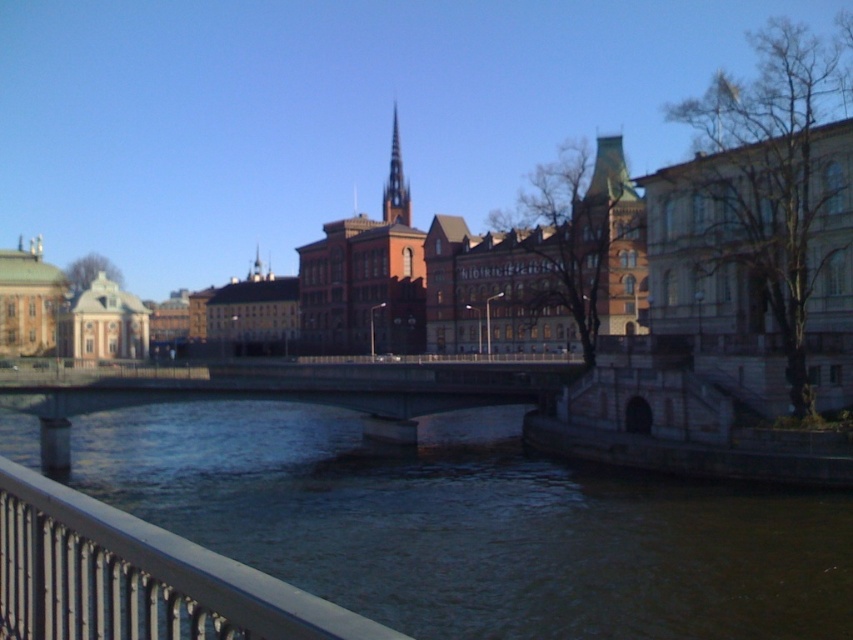
From the picture: You are a city planner evaluating the riverside area. You need to determine which of the two objects, the brown concrete river at center or the smooth stone spire at center, is more suitable for installing a new public art installation. Based on their sizes, which one would you recommend and why?

The smooth stone spire at center is larger than the brown concrete river at center, making it a better candidate for a public art installation as it can accommodate larger sculptures or structures.